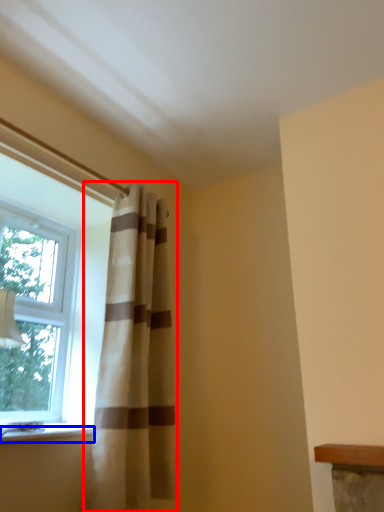
Question: Among these objects, which one is farthest to the camera, curtain (highlighted by a red box) or window sill (highlighted by a blue box)?

Choices:
 (A) curtain
 (B) window sill

Answer: (A)